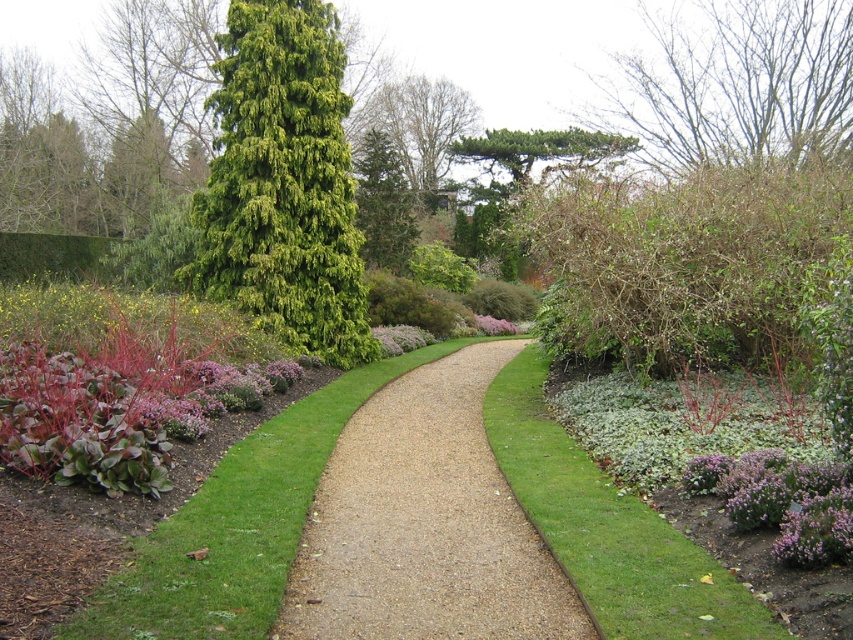
Question: Where is green leafy tree at upper center located in relation to purple fluffy flower at center in the image?

Choices:
 (A) above
 (B) below

Answer: (A)

Question: From the image, what is the correct spatial relationship of green leafy bush at upper right in relation to purple fluffy flower at center?

Choices:
 (A) right
 (B) left

Answer: (A)

Question: Estimate the real-world distances between objects in this image. Which object is farther from the green glossy evergreen tree at upper left?

Choices:
 (A) green soft grass at center-right
 (B) purple fluffy flower at center
 (C) bare branches at upper center
 (D) green grass at lower left

Answer: (C)

Question: Which point is farther to the camera?

Choices:
 (A) (541, 387)
 (B) (434, 566)

Answer: (A)

Question: Does gravel path at center appear on the right side of green glossy evergreen tree at upper left?

Choices:
 (A) no
 (B) yes

Answer: (B)

Question: Which object is positioned farthest from the green grass at lower left?

Choices:
 (A) purple fluffy flower at center
 (B) purple matte flower at lower right
 (C) gravel path at center
 (D) green glossy evergreen tree at upper left

Answer: (A)